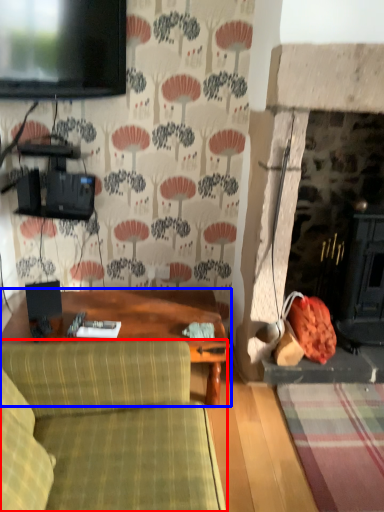
Question: Which of the following is the closest to the observer, studio couch (highlighted by a red box) or table (highlighted by a blue box)?

Choices:
 (A) studio couch
 (B) table

Answer: (A)